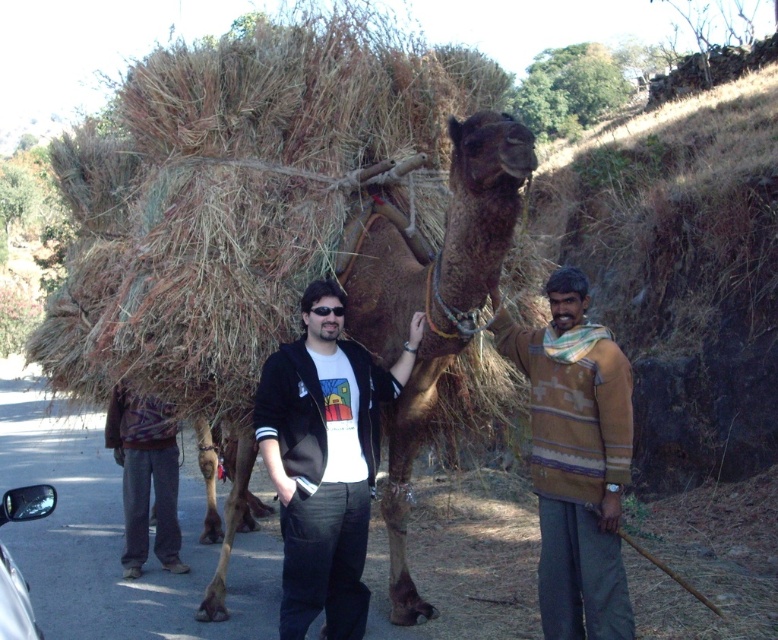
Question: Estimate the real-world distances between objects in this image. Which object is closer to the brown rough camel at center?

Choices:
 (A) black cotton jacket at center
 (B) woolen sweater at center
 (C) dark gray pants at center

Answer: (A)

Question: Does woolen sweater at center come in front of dark gray pants at center?

Choices:
 (A) yes
 (B) no

Answer: (A)

Question: Does brown rough camel at center have a larger size compared to dark gray pants at center?

Choices:
 (A) yes
 (B) no

Answer: (A)

Question: Which of the following is the closest to the observer?

Choices:
 (A) woolen sweater at center
 (B) black cotton jacket at center

Answer: (B)

Question: Can you confirm if black cotton jacket at center is positioned above woolen sweater at center?

Choices:
 (A) yes
 (B) no

Answer: (B)

Question: Which point is closer to the camera?

Choices:
 (A) (612, 470)
 (B) (321, 300)
 (C) (128, 538)
 (D) (359, 230)

Answer: (A)